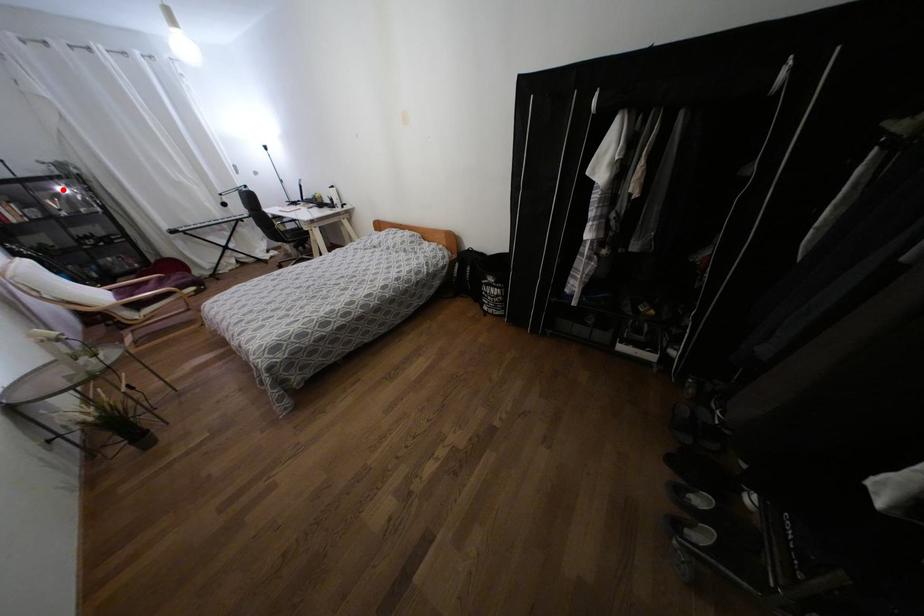
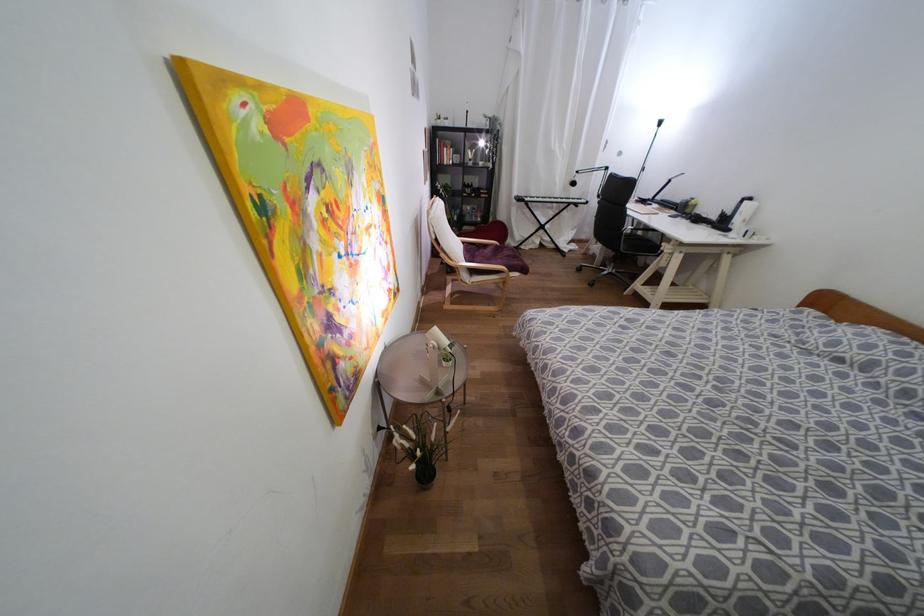
Where in the second image is the point corresponding to the highlighted location from the first image?

(480, 143)